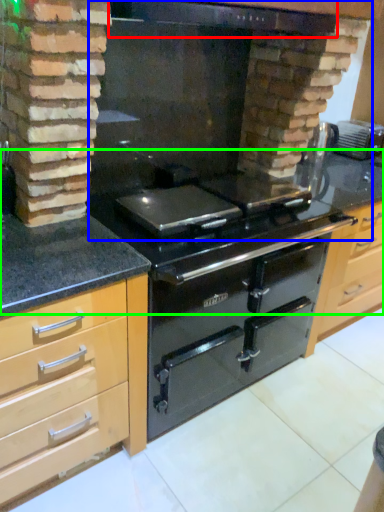
Question: Estimate the real-world distances between objects in this image. Which object is farther from exhaust hood (highlighted by a red box), fireplace (highlighted by a blue box) or counter top (highlighted by a green box)?

Choices:
 (A) fireplace
 (B) counter top

Answer: (B)